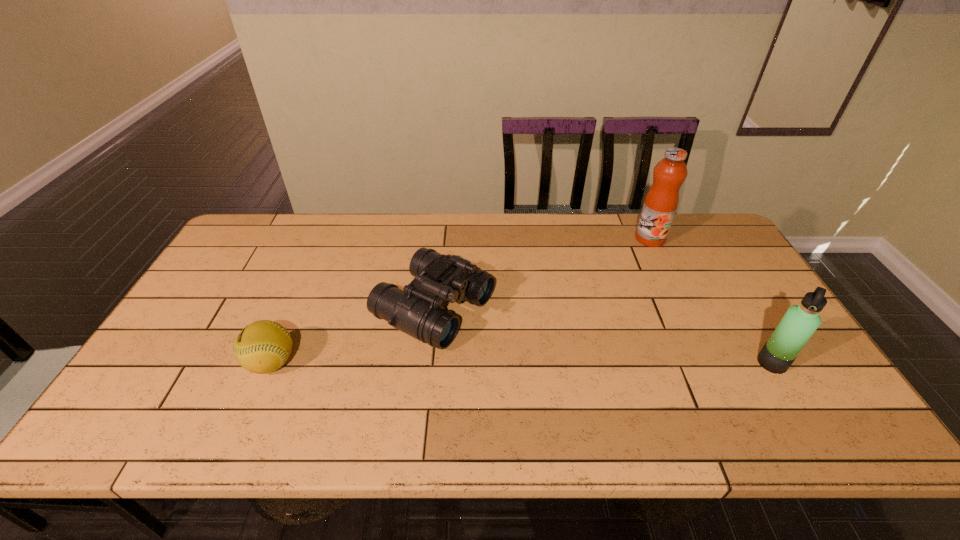
What are the coordinates of `free space located on the left of the second tallest object` in the screenshot? It's located at (718, 363).

Find the location of a particular element. This screenshot has height=540, width=960. free space located on the front label of the farthest object is located at coordinates (598, 313).

Identify the location of vacant area situated 0.100m on the front label of the farthest object. The height and width of the screenshot is (540, 960). (634, 262).

Locate an element on the screen. blank space located on the front label of the farthest object is located at coordinates (634, 262).

Where is `vacant space situated 0.290m through the lenses of the second shortest object`? The image size is (960, 540). vacant space situated 0.290m through the lenses of the second shortest object is located at coordinates (589, 382).

Find the location of a particular element. Image resolution: width=960 pixels, height=540 pixels. free space located through the lenses of the second shortest object is located at coordinates (537, 357).

The image size is (960, 540). In order to click on vacant space situated through the lenses of the second shortest object in this screenshot , I will do `click(559, 368)`.

Identify the location of object that is positioned at the far edge. (660, 204).

In order to click on softball that is positioned at the near edge in this screenshot , I will do `click(262, 347)`.

Find the location of a particular element. This screenshot has height=540, width=960. thermos bottle present at the near edge is located at coordinates (799, 323).